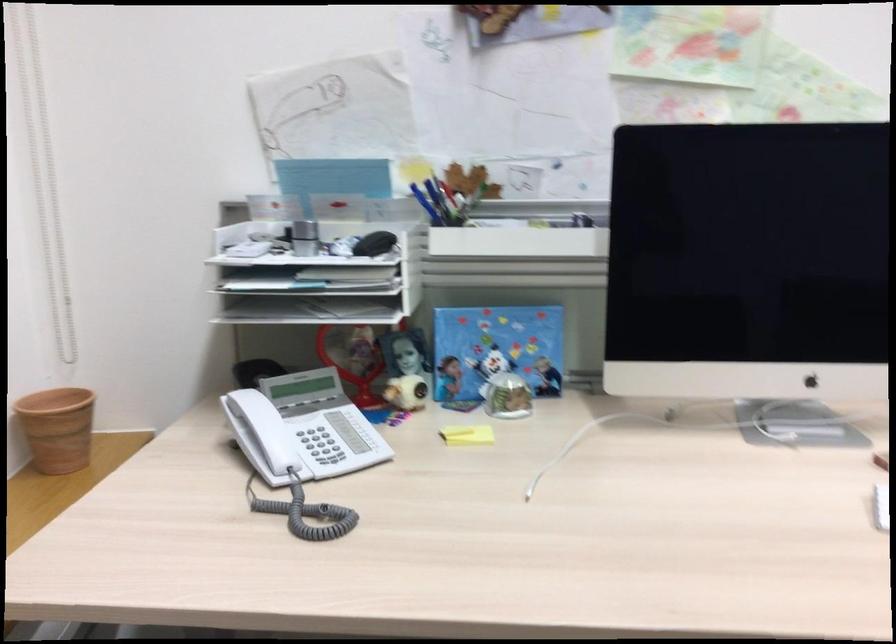
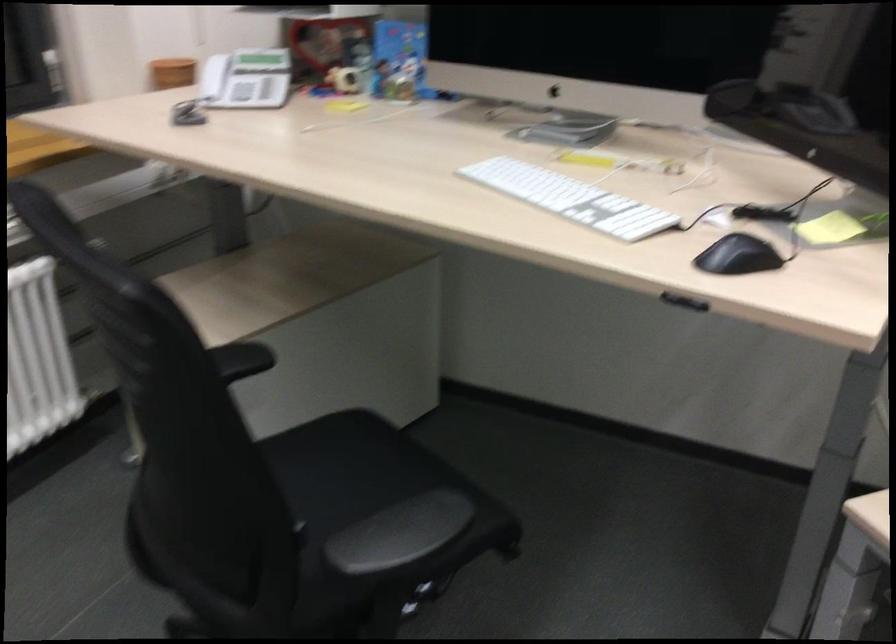
Where in the second image is the point corresponding to (269,427) from the first image?

(212, 77)